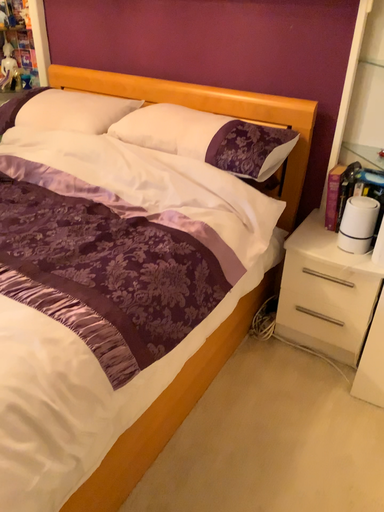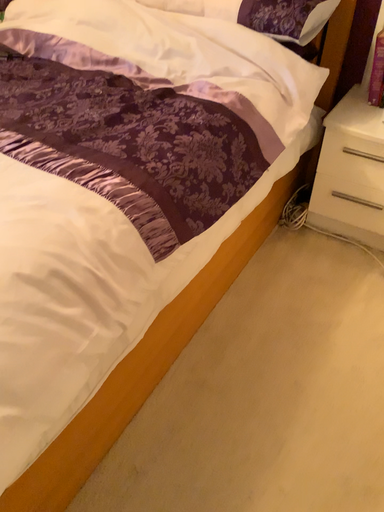
Question: How did the camera likely rotate when shooting the video?

Choices:
 (A) rotated upward
 (B) rotated downward

Answer: (B)